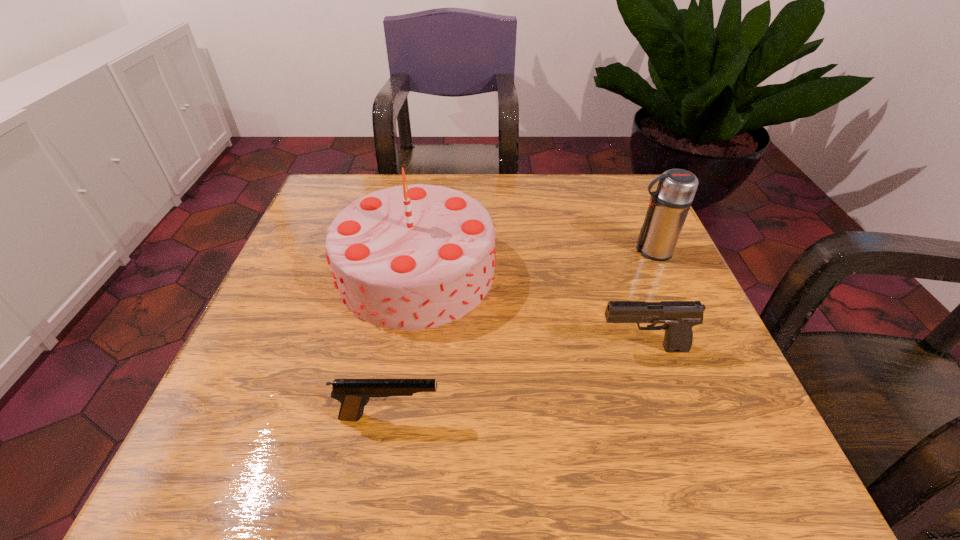
The height and width of the screenshot is (540, 960). In order to click on blank space located aim along the barrel of the farther pistol in this screenshot , I will do `click(461, 349)`.

Locate an element on the screen. This screenshot has height=540, width=960. free space located 0.380m aim along the barrel of the farther pistol is located at coordinates (382, 349).

You are a GUI agent. You are given a task and a screenshot of the screen. Output one action in this format:
    pyautogui.click(x=<x>, y=<y>)
    Task: Click on the free space located 0.270m aim along the barrel of the farther pistol
    The image size is (960, 540).
    Given the screenshot: What is the action you would take?
    pyautogui.click(x=444, y=349)

This screenshot has width=960, height=540. In order to click on vacant space situated at the muzzle of the shorter pistol in this screenshot , I will do `click(635, 416)`.

Locate an element on the screen. The image size is (960, 540). object located in the far edge section of the desktop is located at coordinates (410, 257).

Find the location of `object situated at the left edge`. object situated at the left edge is located at coordinates (410, 257).

Image resolution: width=960 pixels, height=540 pixels. Find the location of `thermos bottle that is at the right edge`. thermos bottle that is at the right edge is located at coordinates (669, 205).

At what (x,y) coordinates should I click in order to perform the action: click on pistol that is positioned at the right edge. Please return your answer as a coordinate pair (x, y). Looking at the image, I should click on (679, 317).

This screenshot has width=960, height=540. I want to click on object at the far left corner, so click(x=410, y=257).

This screenshot has height=540, width=960. I want to click on vacant space at the far edge of the desktop, so click(520, 206).